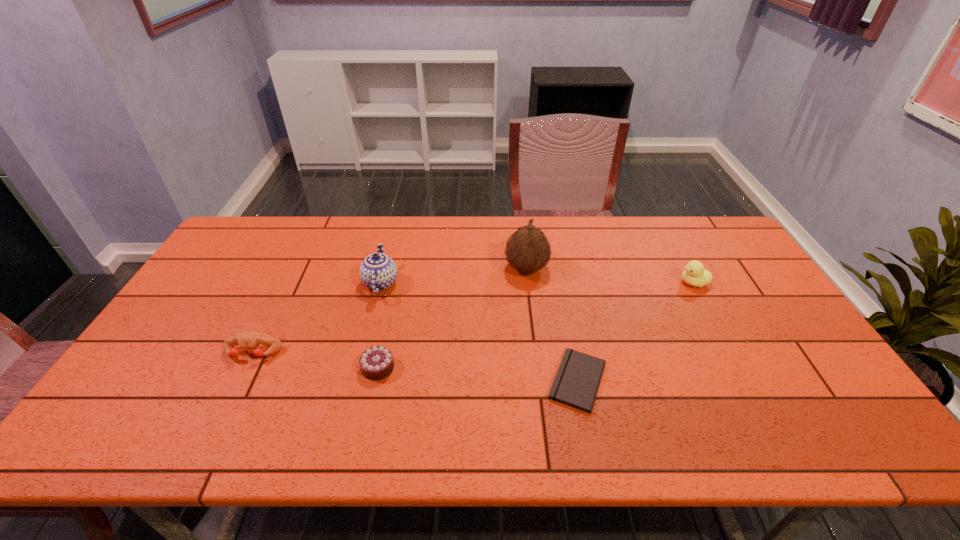
This screenshot has width=960, height=540. In the image, there is a desktop. Identify the location of vacant area at the left edge. (202, 296).

At what (x,y) coordinates should I click in order to perform the action: click on blank space at the right edge of the desktop. Please return your answer as a coordinate pair (x, y). Looking at the image, I should click on (731, 287).

You are a GUI agent. You are given a task and a screenshot of the screen. Output one action in this format:
    pyautogui.click(x=<x>, y=<y>)
    Task: Click on the vacant space at the far left corner of the desktop
    
    Given the screenshot: What is the action you would take?
    pyautogui.click(x=261, y=237)

In the image, there is a desktop. Identify the location of free space at the near left corner. Image resolution: width=960 pixels, height=540 pixels. (162, 416).

The image size is (960, 540). In order to click on free space at the near right corner in this screenshot , I will do pos(850,440).

Where is `free area in between the third tallest object and the chocolate cake`? The width and height of the screenshot is (960, 540). free area in between the third tallest object and the chocolate cake is located at coordinates (536, 325).

I want to click on unoccupied position between the chocolate cake and the coconut, so click(452, 318).

At what (x,y) coordinates should I click in order to perform the action: click on free space between the coconut and the checkbook. Please return your answer as a coordinate pair (x, y). The height and width of the screenshot is (540, 960). Looking at the image, I should click on (552, 324).

This screenshot has height=540, width=960. Identify the location of free spot between the puncher and the chinaware. (317, 318).

Locate an element on the screen. Image resolution: width=960 pixels, height=540 pixels. unoccupied area between the fifth shortest object and the tallest object is located at coordinates (453, 275).